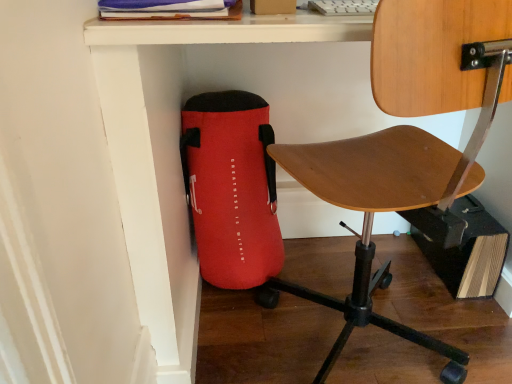
Question: Are red fabric bag at lower left and wooden seat at center located far from each other?

Choices:
 (A) yes
 (B) no

Answer: (B)

Question: Does red fabric bag at lower left appear on the left side of wooden seat at center?

Choices:
 (A) no
 (B) yes

Answer: (B)

Question: Is red fabric bag at lower left bigger than wooden seat at center?

Choices:
 (A) yes
 (B) no

Answer: (B)

Question: From a real-world perspective, is red fabric bag at lower left physically above wooden seat at center?

Choices:
 (A) yes
 (B) no

Answer: (B)

Question: Is red fabric bag at lower left wider than wooden seat at center?

Choices:
 (A) yes
 (B) no

Answer: (B)

Question: From the image's perspective, is red fabric bag at lower left below wooden seat at center?

Choices:
 (A) yes
 (B) no

Answer: (A)

Question: Considering the relative positions of wooden seat at center and red fabric bag at lower left in the image provided, is wooden seat at center to the right of red fabric bag at lower left from the viewer's perspective?

Choices:
 (A) yes
 (B) no

Answer: (A)

Question: Is wooden seat at center aimed at red fabric bag at lower left?

Choices:
 (A) no
 (B) yes

Answer: (B)

Question: Is wooden seat at center located outside red fabric bag at lower left?

Choices:
 (A) yes
 (B) no

Answer: (A)

Question: Is wooden seat at center bigger than red fabric bag at lower left?

Choices:
 (A) no
 (B) yes

Answer: (B)

Question: Can you confirm if wooden seat at center is shorter than red fabric bag at lower left?

Choices:
 (A) yes
 (B) no

Answer: (B)

Question: Does wooden seat at center have a smaller size compared to red fabric bag at lower left?

Choices:
 (A) yes
 (B) no

Answer: (B)

Question: In terms of height, does red fabric bag at lower left look taller or shorter compared to wooden seat at center?

Choices:
 (A) tall
 (B) short

Answer: (B)